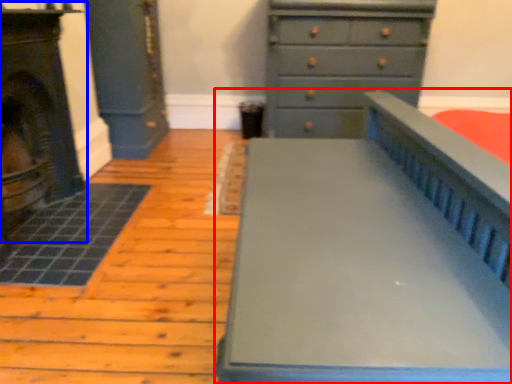
Question: Which object appears farthest to the camera in this image, furniture (highlighted by a red box) or fireplace (highlighted by a blue box)?

Choices:
 (A) furniture
 (B) fireplace

Answer: (B)